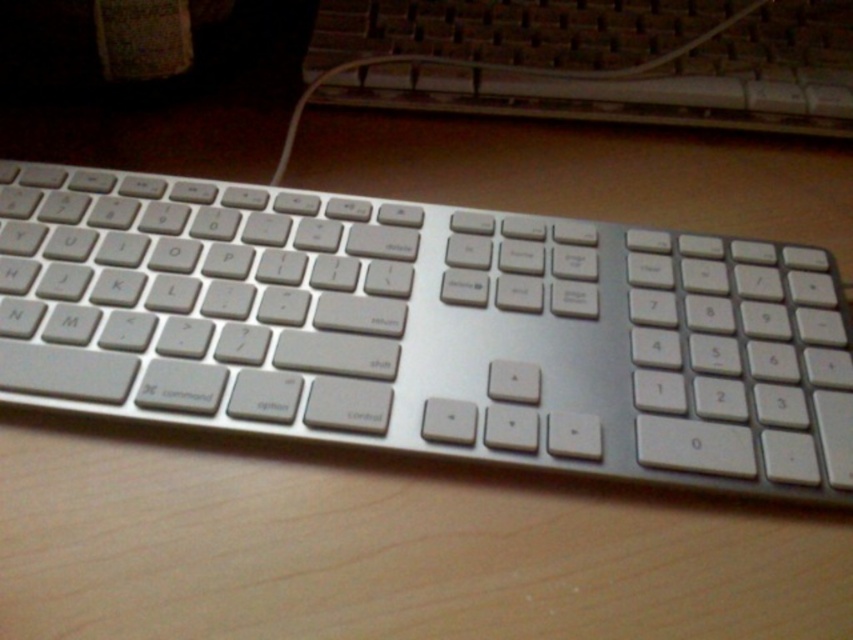
Question: Is silver metallic keyboard at center to the right of satin silver keyboard at upper center from the viewer's perspective?

Choices:
 (A) yes
 (B) no

Answer: (B)

Question: Which point is farther from the camera taking this photo?

Choices:
 (A) (x=311, y=266)
 (B) (x=463, y=28)

Answer: (B)

Question: Which point appears farthest from the camera in this image?

Choices:
 (A) (408, 93)
 (B) (645, 257)

Answer: (A)

Question: Is silver metallic keyboard at center closer to camera compared to satin silver keyboard at upper center?

Choices:
 (A) no
 (B) yes

Answer: (B)

Question: Does silver metallic keyboard at center lie behind satin silver keyboard at upper center?

Choices:
 (A) no
 (B) yes

Answer: (A)